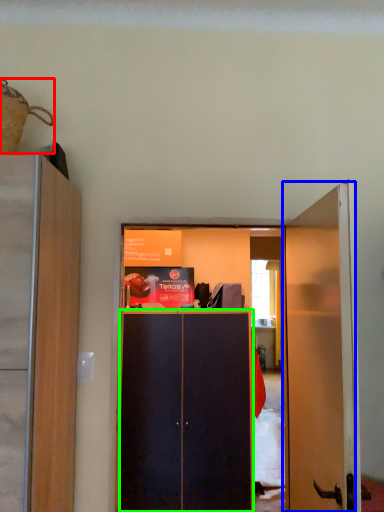
Question: Estimate the real-world distances between objects in this image. Which object is closer to houseplant (highlighted by a red box), door (highlighted by a blue box) or screen door (highlighted by a green box)?

Choices:
 (A) door
 (B) screen door

Answer: (A)